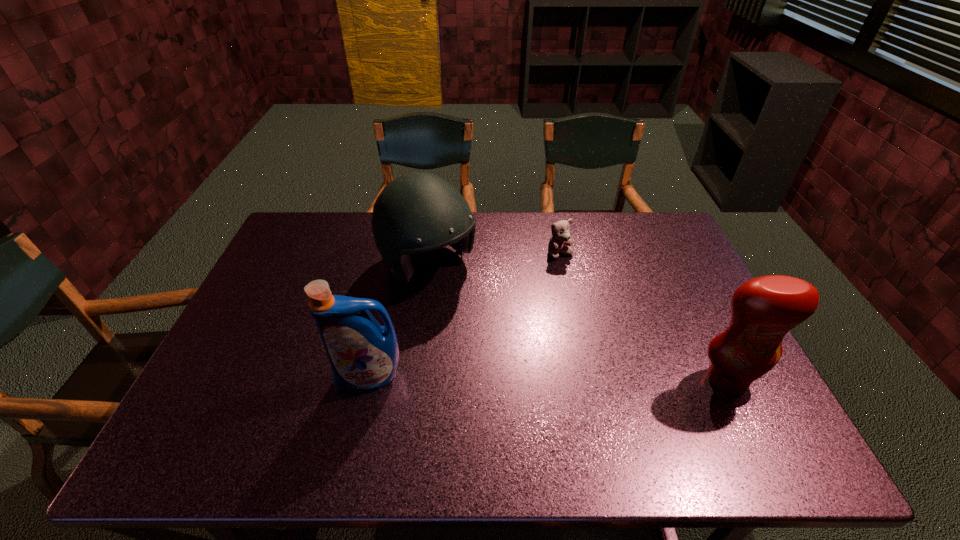
Identify the location of free space on the desktop that is between the detergent and the condiment and is positioned at the face of the teddy bear. (601, 379).

Find the location of `vacant space on the desktop that is between the detergent and the condiment and is positioned at the face opening of the football helmet`. vacant space on the desktop that is between the detergent and the condiment and is positioned at the face opening of the football helmet is located at coordinates (552, 379).